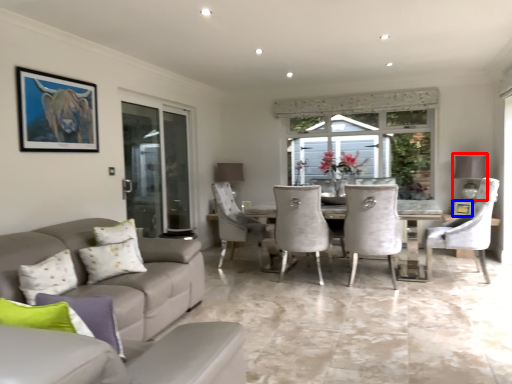
Question: Which object is closer to the camera taking this photo, lamp (highlighted by a red box) or picture frame (highlighted by a blue box)?

Choices:
 (A) lamp
 (B) picture frame

Answer: (A)